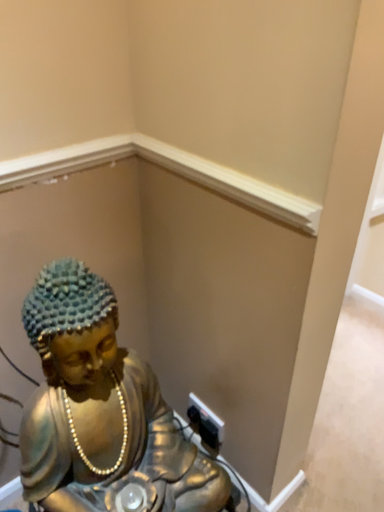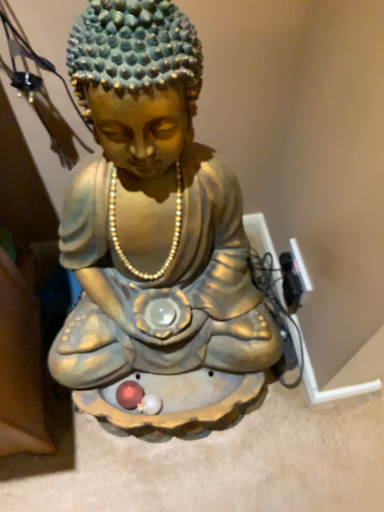
Question: Which way did the camera rotate in the video?

Choices:
 (A) rotated upward
 (B) rotated downward

Answer: (B)